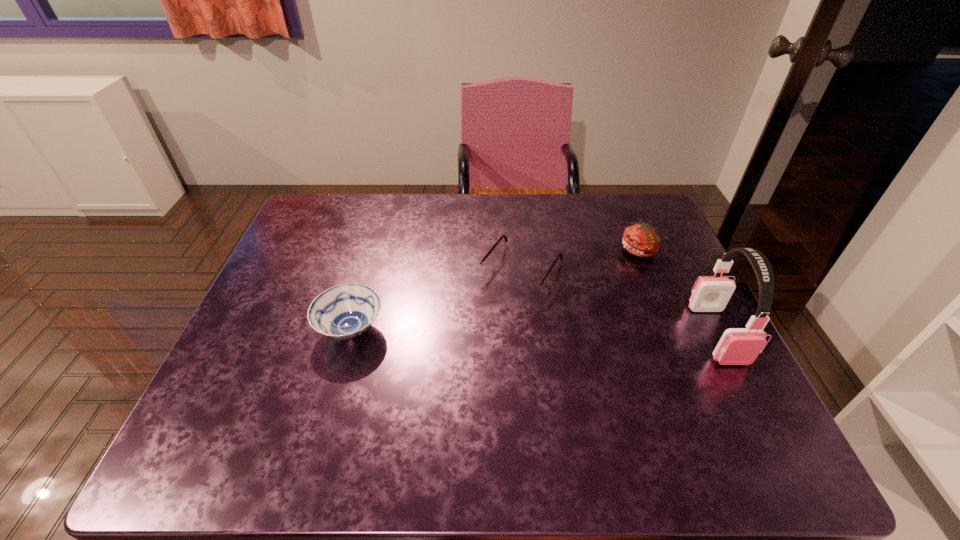
In the image, there is a desktop. Where is `vacant space at the left edge`? This screenshot has width=960, height=540. vacant space at the left edge is located at coordinates (287, 254).

Identify the location of vacant space at the right edge. (669, 309).

You are a GUI agent. You are given a task and a screenshot of the screen. Output one action in this format:
    pyautogui.click(x=<x>, y=<y>)
    Task: Click on the free point at the far left corner
    This screenshot has width=960, height=540.
    Given the screenshot: What is the action you would take?
    pyautogui.click(x=344, y=198)

Where is `vacant area at the far right corner of the desktop`? This screenshot has height=540, width=960. vacant area at the far right corner of the desktop is located at coordinates (617, 238).

In the image, there is a desktop. Where is `blank space at the near right corner`? Image resolution: width=960 pixels, height=540 pixels. blank space at the near right corner is located at coordinates (730, 409).

Identify the location of vacant area that lies between the tomato and the spectacles. (581, 260).

Where is `free space between the soup bowl and the earphone`? free space between the soup bowl and the earphone is located at coordinates (534, 332).

At what (x,y) coordinates should I click in order to perform the action: click on free space between the tallest object and the leftmost object. Please return your answer as a coordinate pair (x, y). This screenshot has height=540, width=960. Looking at the image, I should click on (534, 332).

Find the location of a particular element. unoccupied position between the third tallest object and the third shortest object is located at coordinates (495, 290).

I want to click on free space that is in between the third shortest object and the tallest object, so click(x=678, y=292).